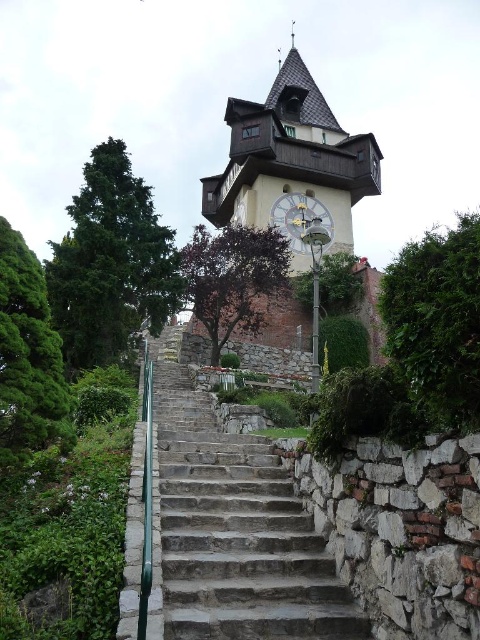
Question: Considering the relative positions of gray stone stairs at center and dark green coniferous tree at left in the image provided, where is gray stone stairs at center located with respect to dark green coniferous tree at left?

Choices:
 (A) above
 (B) below

Answer: (B)

Question: Is green leafy tree at left positioned before purple leafy tree at center?

Choices:
 (A) no
 (B) yes

Answer: (B)

Question: Which point is farther to the camera?

Choices:
 (A) (445, 413)
 (B) (33, 276)

Answer: (B)

Question: Among these objects, which one is nearest to the camera?

Choices:
 (A) wooden clock tower at upper center
 (B) dark green coniferous tree at left
 (C) green leafy tree at right

Answer: (C)

Question: Can you confirm if gray stone stairs at center is positioned above green plastic rail at center?

Choices:
 (A) no
 (B) yes

Answer: (A)

Question: Which object is the farthest from the green leafy tree at left?

Choices:
 (A) white wooden clock at center
 (B) gray stone stairs at center

Answer: (A)